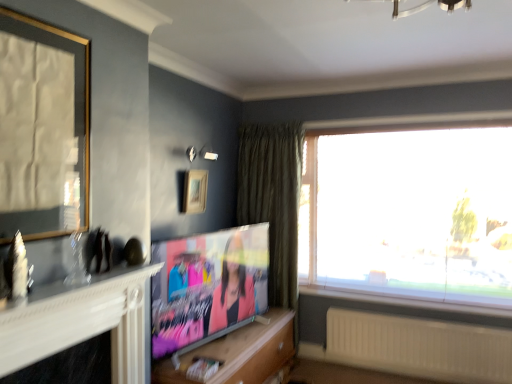
At what (x,y) coordinates should I click in order to perform the action: click on vacant area on top of white ribbed radiator at lower right (from a real-world perspective). Please return your answer as a coordinate pair (x, y). This screenshot has height=384, width=512. Looking at the image, I should click on (420, 323).